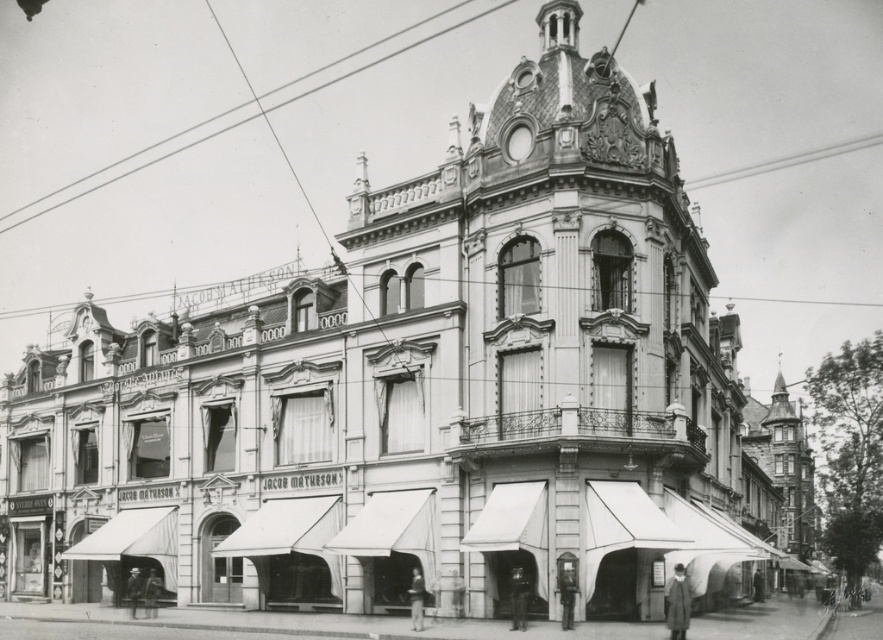
Does white fabric canopy at lower center have a larger size compared to white fabric canopy at lower left?

Incorrect, white fabric canopy at lower center is not larger than white fabric canopy at lower left.

Is point (311, 509) positioned in front of point (151, 509)?

That is True.

You are a GUI agent. You are given a task and a screenshot of the screen. Output one action in this format:
    pyautogui.click(x=<x>, y=<y>)
    Task: Click on the white fabric canopy at lower center
    
    Given the screenshot: What is the action you would take?
    pyautogui.click(x=274, y=525)